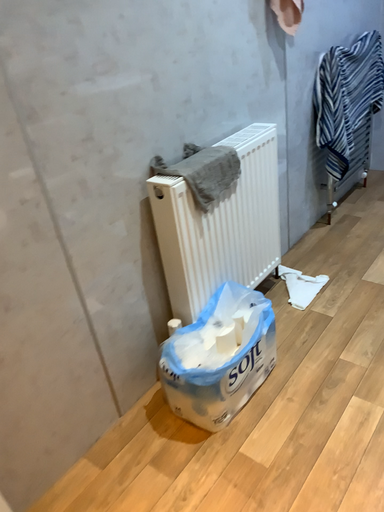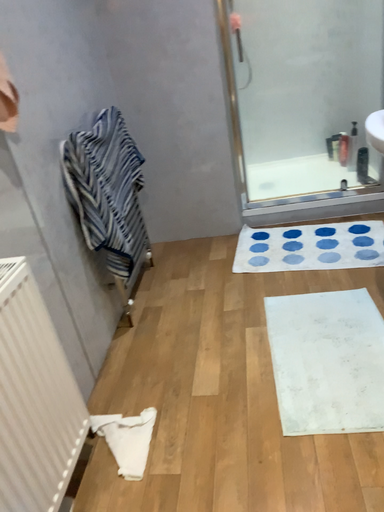
Question: Which way did the camera rotate in the video?

Choices:
 (A) rotated right
 (B) rotated left

Answer: (A)